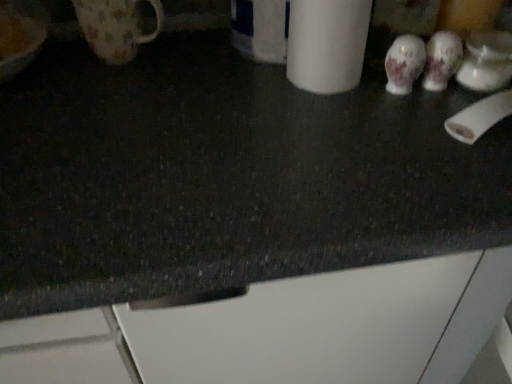
Question: From the image's perspective, is white matte paper towel at upper right positioned above or below white matte toilet paper at right?

Choices:
 (A) below
 (B) above

Answer: (B)

Question: From a real-world perspective, is white matte paper towel at upper right positioned above or below white matte toilet paper at right?

Choices:
 (A) above
 (B) below

Answer: (A)

Question: Which object is positioned farthest from the floral ceramic mug at upper left, the second mug from the right?

Choices:
 (A) white matte toilet paper at right
 (B) white porcelain mug at upper right, the 2th mug from the left
 (C) white matte paper towel at upper right

Answer: (B)

Question: Which object is the farthest from the white matte paper towel at upper right?

Choices:
 (A) floral ceramic mug at upper left, the first mug when ordered from left to right
 (B) white matte toilet paper at right
 (C) white porcelain mug at upper right, the 2th mug from the left

Answer: (A)